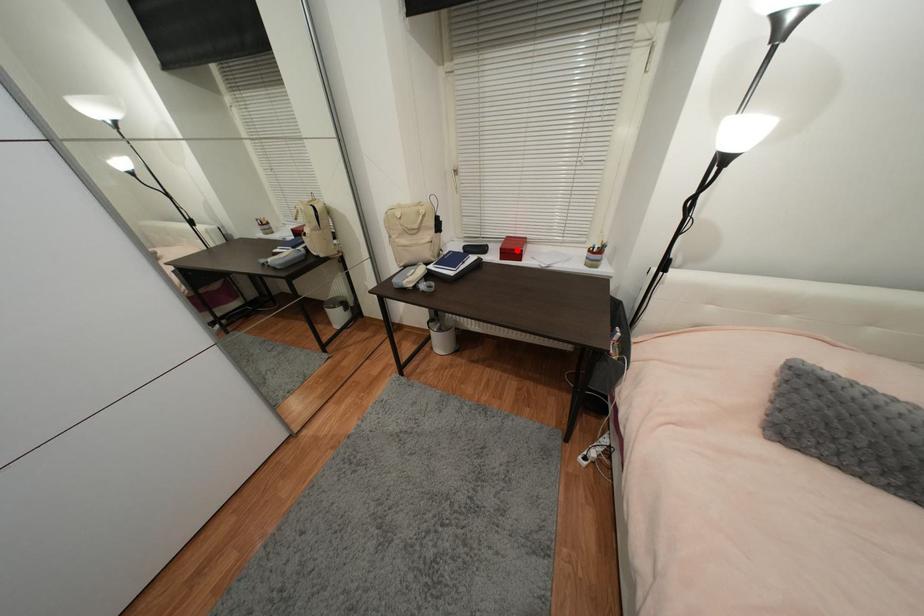
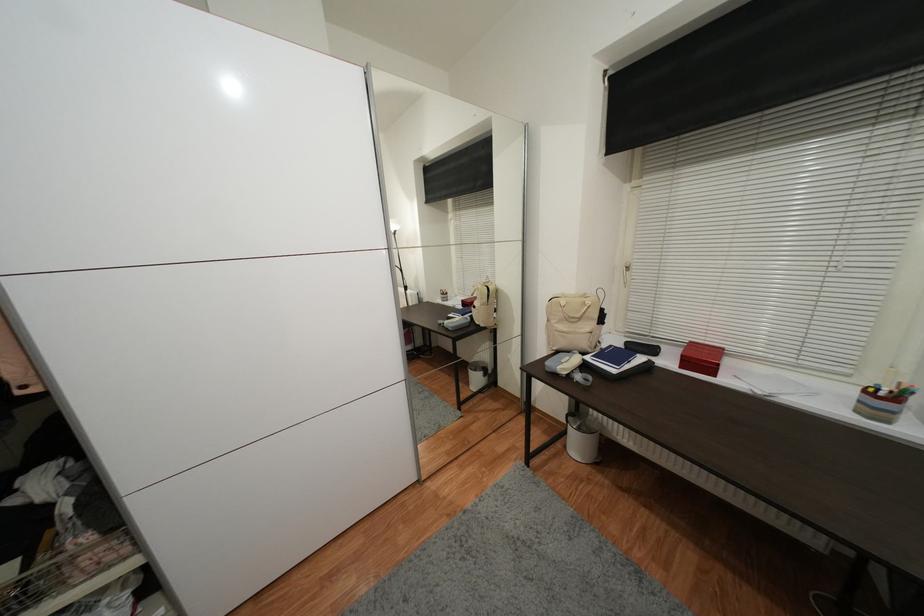
Locate, in the second image, the point that corresponds to the highlighted location in the first image.

(706, 361)